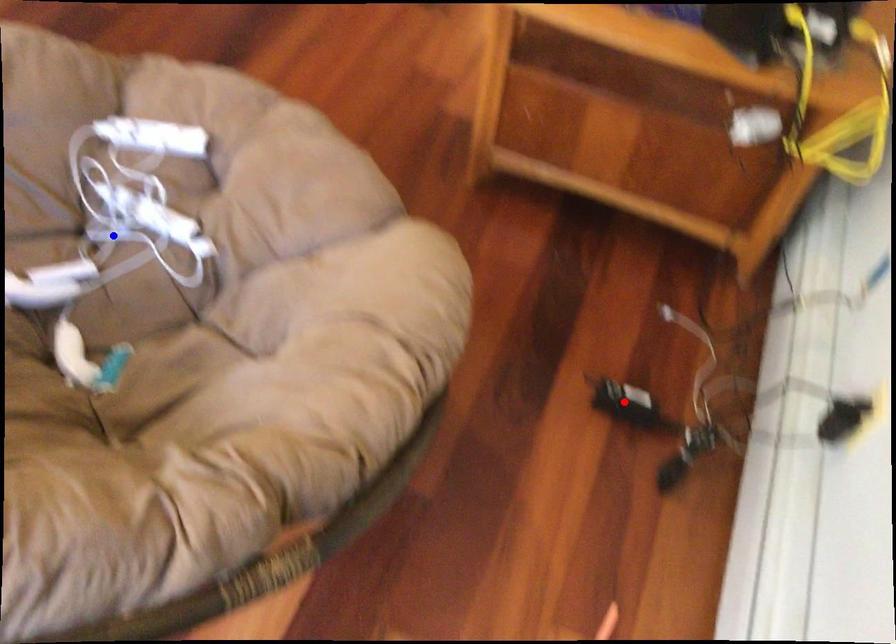
Question: Which of the two points in the image is closer to the camera?

Choices:
 (A) Blue point is closer.
 (B) Red point is closer.

Answer: (A)